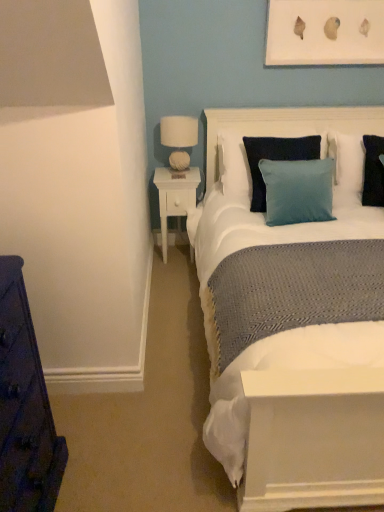
Question: Is white matte picture frame at upper center taller or shorter than white fabric headboard at upper center?

Choices:
 (A) tall
 (B) short

Answer: (B)

Question: Considering their positions, is white matte picture frame at upper center located in front of or behind white fabric headboard at upper center?

Choices:
 (A) behind
 (B) front

Answer: (A)

Question: Which object is the farthest from the white matte picture frame at upper center?

Choices:
 (A) white wood nightstand at center-left
 (B) white fabric headboard at upper center
 (C) white fabric lampshade at upper right
 (D) black matte pillow at right, the second pillow when ordered from back to front
 (E) blue fabric pillow at upper right, marked as the 2th pillow in a front-to-back arrangement

Answer: (A)

Question: Which object is the closest to the white matte picture frame at upper center?

Choices:
 (A) white fabric headboard at upper center
 (B) black matte pillow at right, the second pillow when ordered from back to front
 (C) blue fabric pillow at upper right, the 1th pillow viewed from the back
 (D) white wood nightstand at center-left
 (E) white fabric lampshade at upper right

Answer: (A)